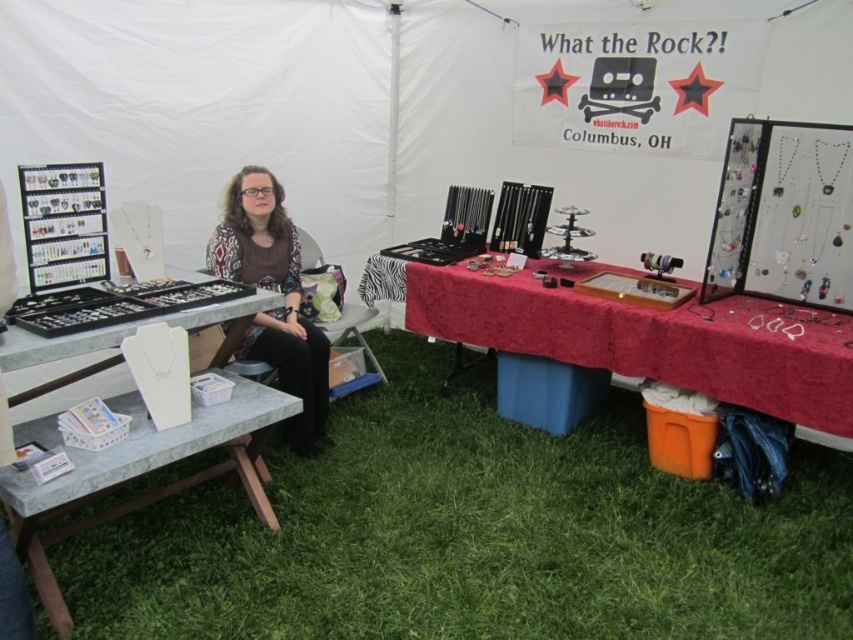
You are a customer at the jewelry stall and want to pick up the matte black sweater at center. Which direction should you move relative to the velvet red table at center?

The velvet red table at center is located above the matte black sweater at center, so you should move downward from the velvet red table at center to reach the matte black sweater at center.

You are a customer at the jewelry stall and want to place a small earring on the velvet red table at center. However, there is a matte black sweater at center in the way. Can you place the earring on the table without moving the sweater?

The velvet red table at center has a lesser height compared to matte black sweater at center, so the sweater is taller than the table. This means the sweater is blocking the table, making it impossible to place the earring on the table without moving the sweater.